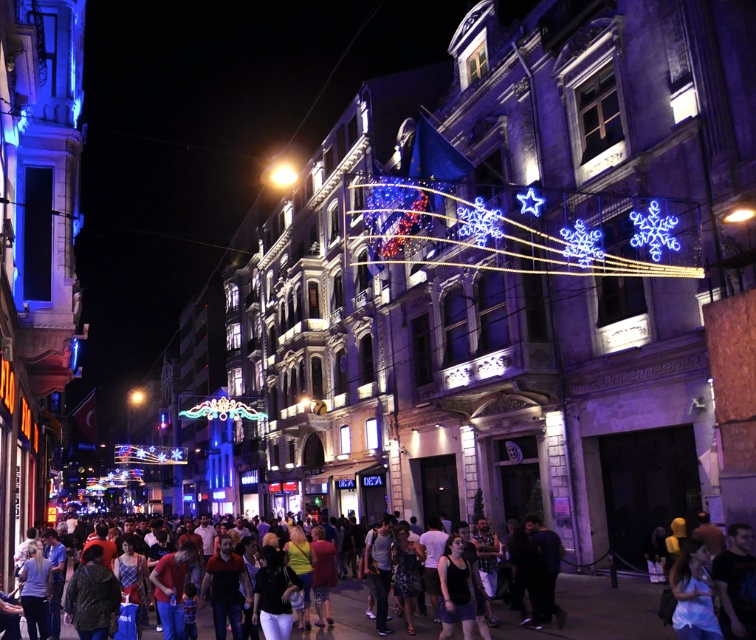
How far apart are multicolored casual clothing at center and bright yellow light at center?

multicolored casual clothing at center is 210.35 meters from bright yellow light at center.

Does point (333, 625) come behind point (287, 180)?

No, it is in front of (287, 180).

Locate an element on the screen. The width and height of the screenshot is (756, 640). multicolored casual clothing at center is located at coordinates (346, 612).

Where is `illuminated plastic snowflake at center`? illuminated plastic snowflake at center is located at coordinates (522, 228).

Is point (397, 259) behind point (352, 593)?

Yes.

At what (x,y) coordinates should I click in order to perform the action: click on illuminated plastic snowflake at center. Please return your answer as a coordinate pair (x, y). The width and height of the screenshot is (756, 640). Looking at the image, I should click on click(x=522, y=228).

Is illuminated plastic snowflake at center above bright yellow light at center?

No, illuminated plastic snowflake at center is not above bright yellow light at center.

Does illuminated plastic snowflake at center appear on the right side of bright yellow light at center?

Yes, illuminated plastic snowflake at center is to the right of bright yellow light at center.

Locate an element on the screen. This screenshot has width=756, height=640. illuminated plastic snowflake at center is located at coordinates (522, 228).